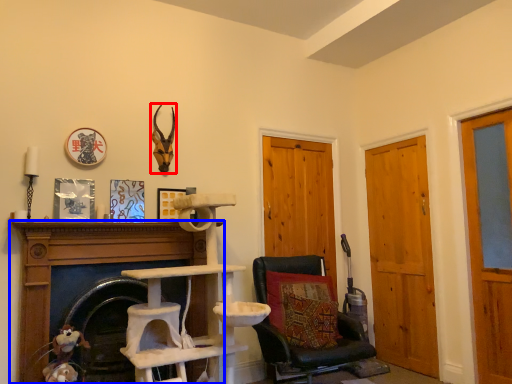
Question: Which of the following is the closest to the observer, animal (highlighted by a red box) or fireplace (highlighted by a blue box)?

Choices:
 (A) animal
 (B) fireplace

Answer: (B)